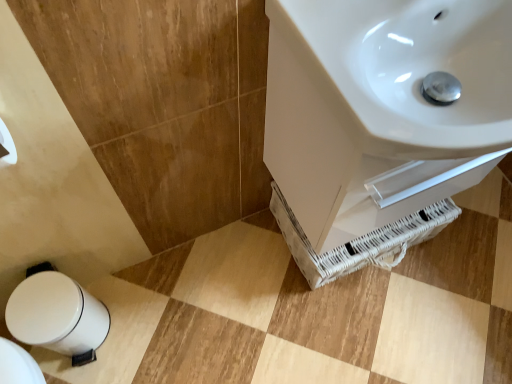
Question: Does point (456, 31) appear closer or farther from the camera than point (11, 291)?

Choices:
 (A) farther
 (B) closer

Answer: (B)

Question: In the image, is white glossy sink at upper right on the left side or the right side of white glossy trash can at lower left?

Choices:
 (A) left
 (B) right

Answer: (B)

Question: Considering their positions, is white glossy sink at upper right located in front of or behind white glossy trash can at lower left?

Choices:
 (A) front
 (B) behind

Answer: (A)

Question: Considering the positions of white glossy trash can at lower left and white glossy sink at upper right in the image, is white glossy trash can at lower left taller or shorter than white glossy sink at upper right?

Choices:
 (A) tall
 (B) short

Answer: (A)

Question: From the image's perspective, is white glossy trash can at lower left above or below white glossy sink at upper right?

Choices:
 (A) below
 (B) above

Answer: (A)

Question: Considering the positions of white glossy trash can at lower left and white glossy sink at upper right in the image, is white glossy trash can at lower left bigger or smaller than white glossy sink at upper right?

Choices:
 (A) small
 (B) big

Answer: (A)

Question: Is white glossy trash can at lower left spatially inside white glossy sink at upper right, or outside of it?

Choices:
 (A) outside
 (B) inside

Answer: (A)